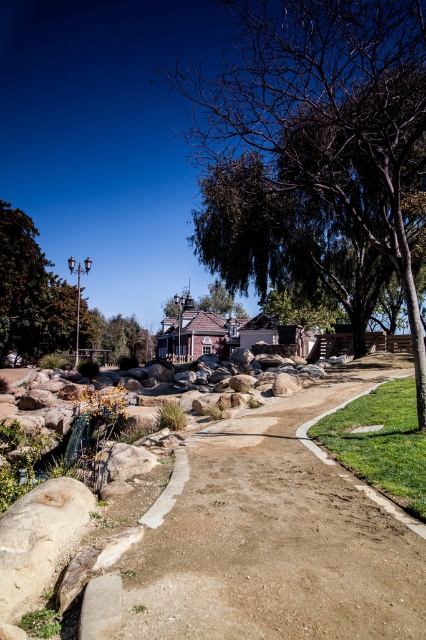
Which is more to the left, brown dirt track at center or white rough rock at lower left?

From the viewer's perspective, white rough rock at lower left appears more on the left side.

Describe the element at coordinates (268, 538) in the screenshot. I see `brown dirt track at center` at that location.

Identify the location of brown dirt track at center. (268, 538).

Who is shorter, brown dirt track at center or green leafy tree at center?

brown dirt track at center

Who is lower down, brown dirt track at center or green leafy tree at center?

brown dirt track at center is below.

Between point (161, 547) and point (239, 316), which one is positioned in front?

Point (161, 547) is in front.

Find the location of a particular element. This screenshot has height=640, width=426. brown dirt track at center is located at coordinates (268, 538).

Is green leafy tree at left above green leafy tree at center?

No, green leafy tree at left is not above green leafy tree at center.

Is green leafy tree at left taller than green leafy tree at center?

Yes, green leafy tree at left is taller than green leafy tree at center.

Does point (37, 337) come in front of point (204, 307)?

That is True.

Locate an element on the screen. The width and height of the screenshot is (426, 640). green leafy tree at left is located at coordinates (31, 291).